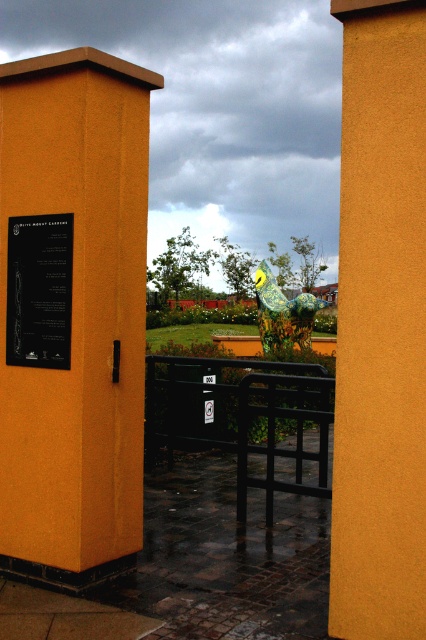
You are standing at the entrance of the garden and see the orange matte pillar at left and the black metal fence at center. Which object is positioned higher in the scene?

The orange matte pillar at left is positioned higher than the black metal fence at center.